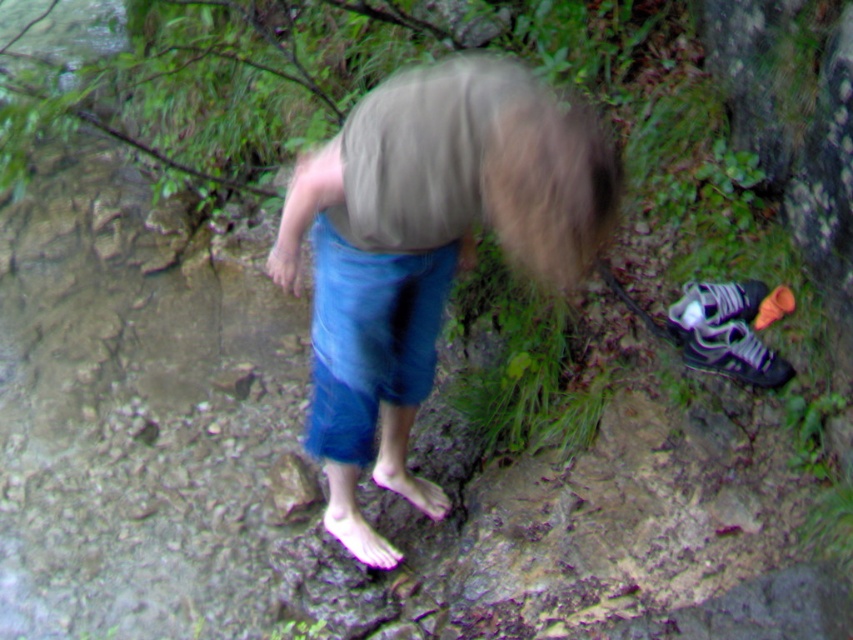
You are a hiker who just arrived at the rocky area and see the black mesh shoe at lower right and the shiny purple sneaker at lower right. Which shoe is closer to you?

The black mesh shoe at lower right is closer to you because it is in front of the shiny purple sneaker at lower right.

You are a hiker who just noticed your items. You see the black mesh shoe at lower right and the shiny purple sneaker at lower right. Which one is closer to your feet?

The black mesh shoe at lower right is positioned under the shiny purple sneaker at lower right, so the shiny purple sneaker at lower right is closer to your feet.

You are a hiker who just noticed your shoes are missing. You see the black mesh shoe at lower right and the shiny purple sneaker at lower right. Which one is taller?

The black mesh shoe at lower right is taller than the shiny purple sneaker at lower right according to the description.